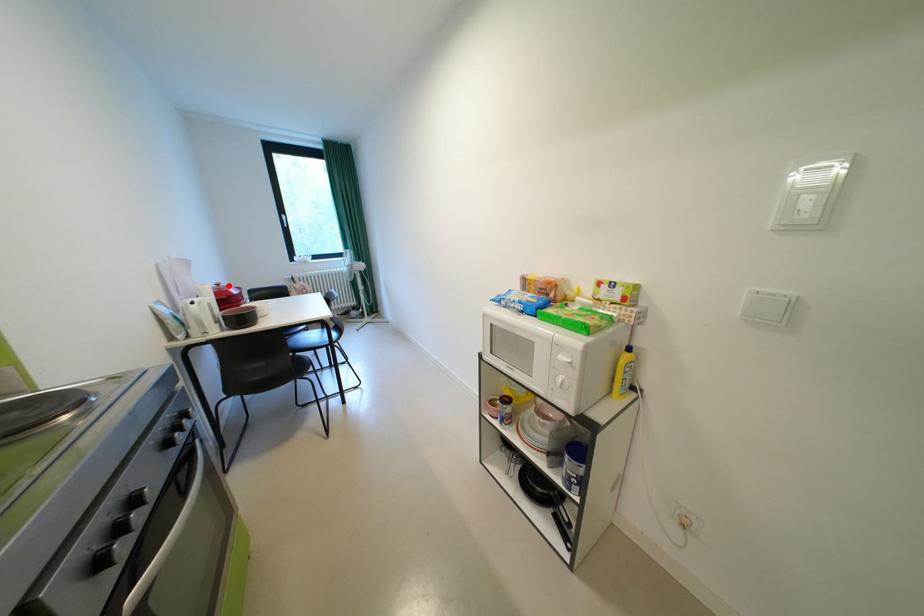
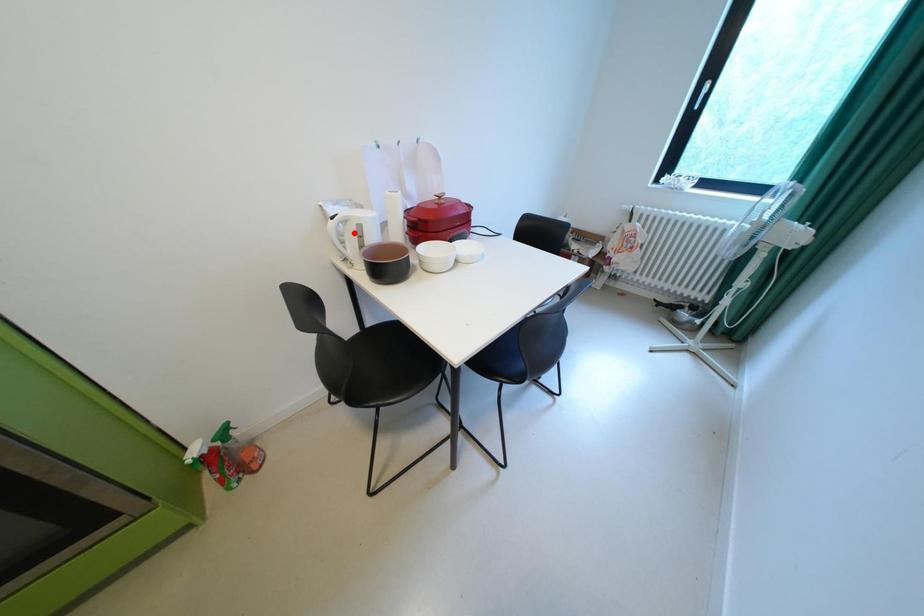
I am providing you with two images of the same scene from different viewpoints. A red point is marked on the first image and another point is marked on the second image. Do the highlighted points in image1 and image2 indicate the same real-world spot?

No